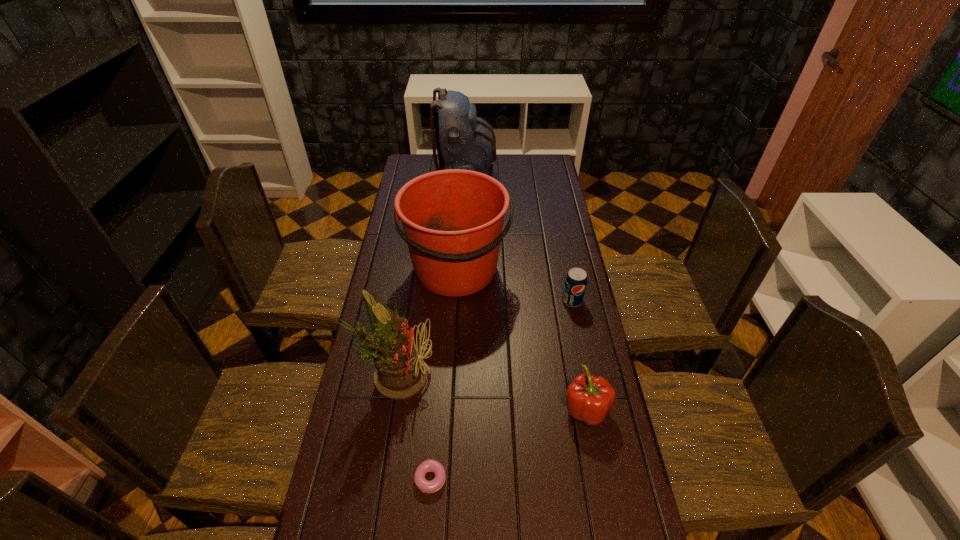
Locate an element on the screen. blank space that satisfies the following two spatial constraints: 1. on the back side of the pop; 2. at the front pocket of the backpack is located at coordinates (547, 178).

Where is `vacant region that satisfies the following two spatial constraints: 1. on the front side of the pepper; 2. on the right side of the bucket`? This screenshot has height=540, width=960. vacant region that satisfies the following two spatial constraints: 1. on the front side of the pepper; 2. on the right side of the bucket is located at coordinates (450, 409).

Find the location of a particular element. Image resolution: width=960 pixels, height=540 pixels. vacant area that satisfies the following two spatial constraints: 1. in front of the flower arrangement with the fan visible; 2. on the right side of the pepper is located at coordinates (390, 409).

The image size is (960, 540). What are the coordinates of `vacant space that satisfies the following two spatial constraints: 1. at the front pocket of the pepper; 2. on the right side of the farthest object` in the screenshot? It's located at (456, 409).

Locate an element on the screen. Image resolution: width=960 pixels, height=540 pixels. free space that satisfies the following two spatial constraints: 1. in front of the flower arrangement with the fan visible; 2. on the right side of the pepper is located at coordinates (390, 409).

In order to click on free space that satisfies the following two spatial constraints: 1. at the front pocket of the backpack; 2. on the back side of the pepper in this screenshot , I will do `click(456, 409)`.

This screenshot has width=960, height=540. I want to click on vacant space that satisfies the following two spatial constraints: 1. on the front side of the pop; 2. in front of the flower arrangement with the fan visible, so click(x=588, y=374).

The image size is (960, 540). In order to click on vacant space that satisfies the following two spatial constraints: 1. in front of the flower arrangement with the fan visible; 2. on the left side of the pepper in this screenshot , I will do `click(390, 409)`.

This screenshot has height=540, width=960. Identify the location of vacant space that satisfies the following two spatial constraints: 1. in front of the flower arrangement with the fan visible; 2. on the back side of the pepper. (390, 409).

Where is `free spot that satisfies the following two spatial constraints: 1. at the front pocket of the farthest object; 2. on the right side of the pop`? The height and width of the screenshot is (540, 960). free spot that satisfies the following two spatial constraints: 1. at the front pocket of the farthest object; 2. on the right side of the pop is located at coordinates (461, 301).